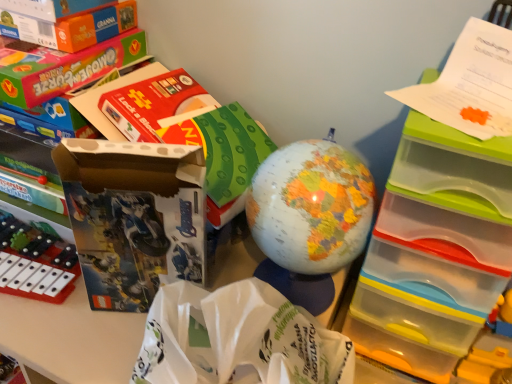
Question: Considering the positions of clear plastic drawers at upper right and matte plastic globe at center, the 2th toy in the right-to-left sequence, in the image, is clear plastic drawers at upper right taller or shorter than matte plastic globe at center, the 2th toy in the right-to-left sequence,?

Choices:
 (A) short
 (B) tall

Answer: (B)

Question: Is point (449, 334) positioned closer to the camera than point (338, 208)?

Choices:
 (A) closer
 (B) farther

Answer: (B)

Question: Which is nearer to the clear plastic drawers at upper right?

Choices:
 (A) orange cardboard box at upper left
 (B) matte plastic xylophone at left, marked as the third toy in a right-to-left arrangement
 (C) yellow plastic toy at lower right, which is counted as the third toy, starting from the left
 (D) matte cardboard box at left
 (E) matte plastic globe at center, the 2th toy in the right-to-left sequence

Answer: (C)

Question: Which is farther from the matte plastic globe at center, which is the 2th toy from left to right?

Choices:
 (A) clear plastic drawers at upper right
 (B) white paper bag at center
 (C) matte cardboard box at left
 (D) orange cardboard box at upper left
 (E) yellow plastic toy at lower right, which is counted as the third toy, starting from the left

Answer: (D)